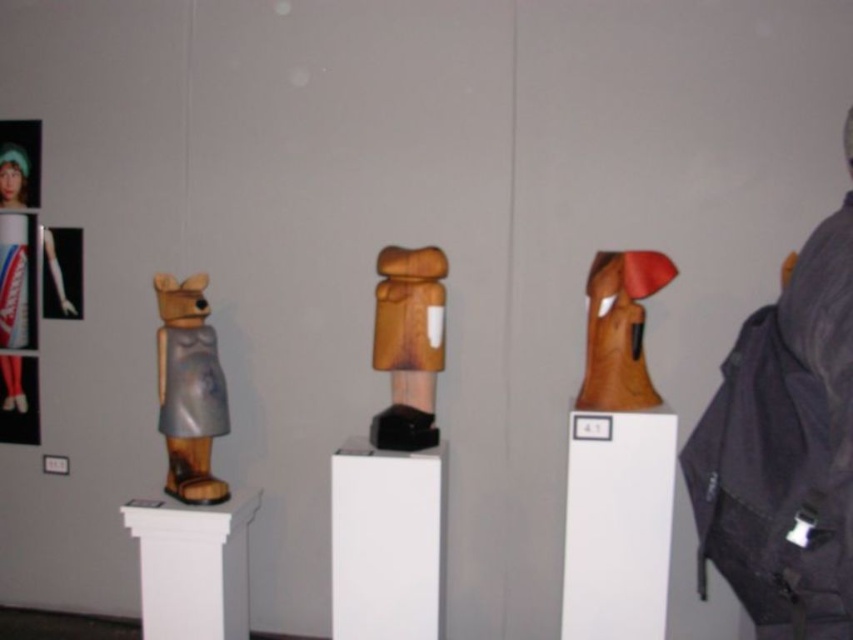
Is wooden statue at center smaller than wooden sculpture at right?

Indeed, wooden statue at center has a smaller size compared to wooden sculpture at right.

Which is more to the left, wooden statue at center or wooden sculpture at right?

Positioned to the left is wooden statue at center.

Which is in front, point (433, 426) or point (602, 296)?

Point (602, 296)

Where is `wooden statue at center`? This screenshot has height=640, width=853. wooden statue at center is located at coordinates (408, 344).

Which is more to the right, dark gray fabric backpack at right or wooden sculpture at right?

dark gray fabric backpack at right

Is the position of dark gray fabric backpack at right more distant than that of wooden sculpture at right?

No, it is not.

Find the location of a particular element. This screenshot has height=640, width=853. dark gray fabric backpack at right is located at coordinates (784, 451).

Which is in front, point (628, 330) or point (0, 180)?

Point (628, 330)

Who is lower down, wooden sculpture at right or metallic silver dress at left?

Positioned lower is wooden sculpture at right.

Which is in front, point (637, 326) or point (12, 122)?

Point (637, 326) is in front.

At what (x,y) coordinates should I click in order to perform the action: click on wooden sculpture at right. Please return your answer as a coordinate pair (x, y). The width and height of the screenshot is (853, 640). Looking at the image, I should click on (619, 330).